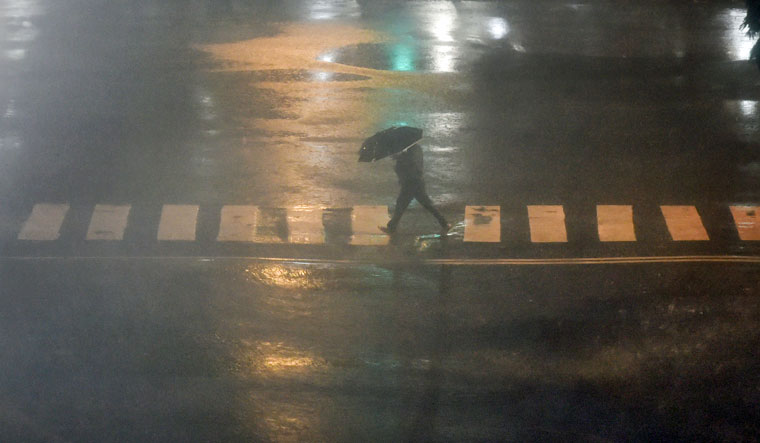
What are the coordinates of `yellow light reflection` in the screenshot? It's located at (282, 274).